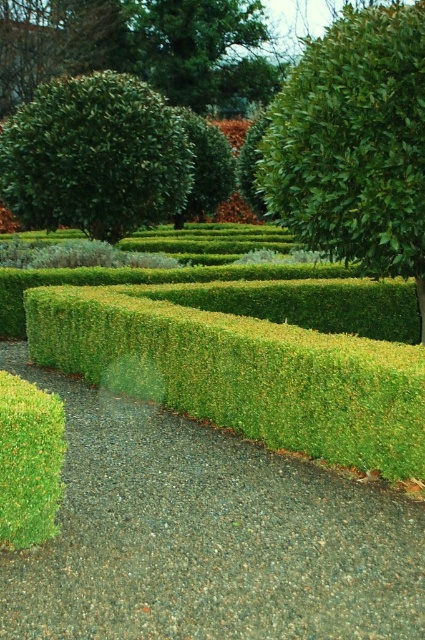
You are standing at the entrance of the garden maze and see the green gravel at center and the green leafy bush at upper right. Which object is taller?

The green leafy bush at upper right is taller than the green gravel at center.

You are standing at the entrance of the garden maze and see the green gravel at center and the green fuzzy bush at center. Which object is taller?

The green fuzzy bush at center is taller than the green gravel at center.

You are standing at the entrance of the garden maze and see the green leafy hedge at center. If you want to reach the hedge, which direction should you walk towards?

The green leafy hedge at center is located at point (255, 362), so you should walk towards the center of the maze to reach it.